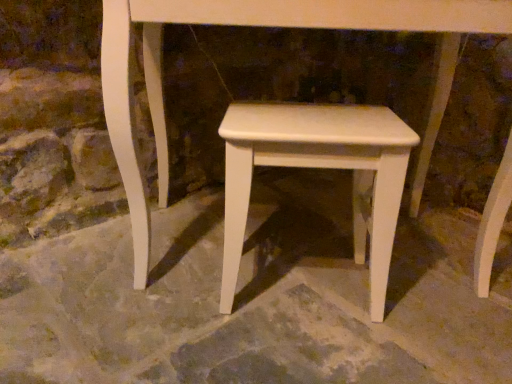
The width and height of the screenshot is (512, 384). What do you see at coordinates (248, 307) in the screenshot? I see `white smooth concrete at center` at bounding box center [248, 307].

Locate an element on the screen. The height and width of the screenshot is (384, 512). white smooth concrete at center is located at coordinates (248, 307).

The height and width of the screenshot is (384, 512). What are the coordinates of `white matte stool at center` in the screenshot? It's located at (322, 168).

What do you see at coordinates (322, 168) in the screenshot?
I see `white matte stool at center` at bounding box center [322, 168].

This screenshot has width=512, height=384. What are the coordinates of `white smooth concrete at center` in the screenshot? It's located at (248, 307).

Considering the positions of objects white matte stool at center and white smooth concrete at center in the image provided, who is more to the right, white matte stool at center or white smooth concrete at center?

Positioned to the right is white matte stool at center.

Which is behind, white matte stool at center or white smooth concrete at center?

white matte stool at center is behind.

Is point (405, 154) farther from camera compared to point (321, 287)?

No.

From the image's perspective, is white matte stool at center on white smooth concrete at center?

Indeed, from the image's perspective, white matte stool at center is shown above white smooth concrete at center.

From a real-world perspective, between white matte stool at center and white smooth concrete at center, who is vertically lower?

white smooth concrete at center, from a real-world perspective.

Does white matte stool at center have a lesser width compared to white smooth concrete at center?

Yes, white matte stool at center is thinner than white smooth concrete at center.

Who is shorter, white matte stool at center or white smooth concrete at center?

white smooth concrete at center.

Can you confirm if white matte stool at center is smaller than white smooth concrete at center?

Indeed, white matte stool at center has a smaller size compared to white smooth concrete at center.

Would you say white smooth concrete at center is part of white matte stool at center's contents?

No, white smooth concrete at center is not a part of white matte stool at center.

Is white matte stool at center with white smooth concrete at center?

They are not placed beside each other.

Is white matte stool at center aimed at white smooth concrete at center?

No, white matte stool at center does not turn towards white smooth concrete at center.

Can you tell me how much white matte stool at center and white smooth concrete at center differ in facing direction?

They differ by 41.6 degrees in their facing directions.

Find the location of `concrete on the left of the white matte stool at center`. concrete on the left of the white matte stool at center is located at coordinates (248, 307).

Considering the relative positions of white smooth concrete at center and white matte stool at center in the image provided, is white smooth concrete at center to the right of white matte stool at center from the viewer's perspective?

Incorrect, white smooth concrete at center is not on the right side of white matte stool at center.

Relative to white matte stool at center, is white smooth concrete at center in front or behind?

white smooth concrete at center is in front of white matte stool at center.

Which is behind, point (325, 328) or point (340, 140)?

Positioned behind is point (325, 328).

From the image's perspective, which one is positioned higher, white smooth concrete at center or white matte stool at center?

white matte stool at center appears higher in the image.

From a real-world perspective, is white smooth concrete at center physically above white matte stool at center?

Actually, white smooth concrete at center is physically below white matte stool at center in the real world.

Which object is wider, white smooth concrete at center or white matte stool at center?

Wider between the two is white smooth concrete at center.

Between white smooth concrete at center and white matte stool at center, which one has more height?

With more height is white matte stool at center.

Considering the relative sizes of white smooth concrete at center and white matte stool at center in the image provided, is white smooth concrete at center bigger than white matte stool at center?

Yes, white smooth concrete at center is bigger than white matte stool at center.

Is white smooth concrete at center located outside white matte stool at center?

Indeed, white smooth concrete at center is completely outside white matte stool at center.

Is white smooth concrete at center directly adjacent to white matte stool at center?

They are not placed beside each other.

Is white smooth concrete at center facing away from white matte stool at center?

white smooth concrete at center is not turned away from white matte stool at center.

How many degrees apart are the facing directions of white smooth concrete at center and white matte stool at center?

The angle between the facing direction of white smooth concrete at center and the facing direction of white matte stool at center is 41.6 degrees.

At what (x,y) coordinates should I click in order to perform the action: click on concrete that appears in front of the white matte stool at center. Please return your answer as a coordinate pair (x, y). Image resolution: width=512 pixels, height=384 pixels. Looking at the image, I should click on 248,307.

The image size is (512, 384). Identify the location of stool above the white smooth concrete at center (from a real-world perspective). (322, 168).

At what (x,y) coordinates should I click in order to perform the action: click on concrete below the white matte stool at center (from a real-world perspective). Please return your answer as a coordinate pair (x, y). Looking at the image, I should click on (248, 307).